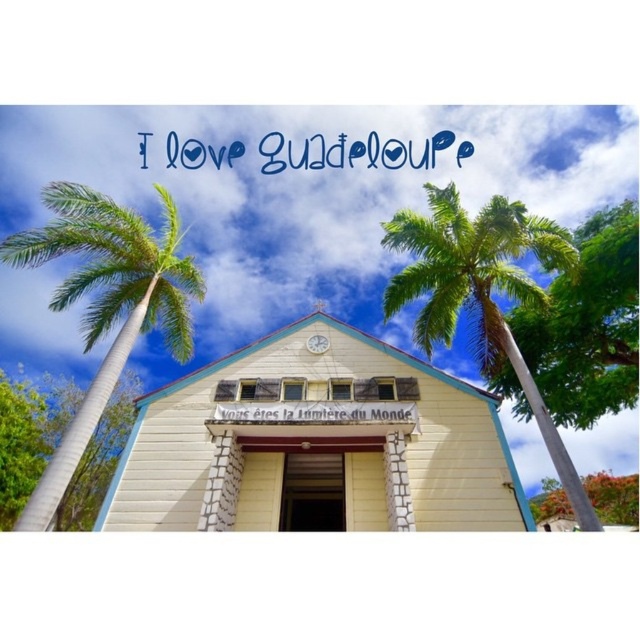
You are standing in front of the building and want to take a photo that includes both the white wood chapel at center and the green leafy palm tree at center. Which object should you focus on first to ensure both are in the frame?

You should focus on the white wood chapel at center first since it is much taller than the green leafy palm tree at center, so adjusting the camera angle to include its full height will naturally include the shorter palm tree in the frame.

You are standing in front of the building and want to know which palm tree is wider. Which one has a larger width between the green leafy palm tree at left and the green leafy palm tree at center?

The green leafy palm tree at left has a larger width than the green leafy palm tree at center according to the description.